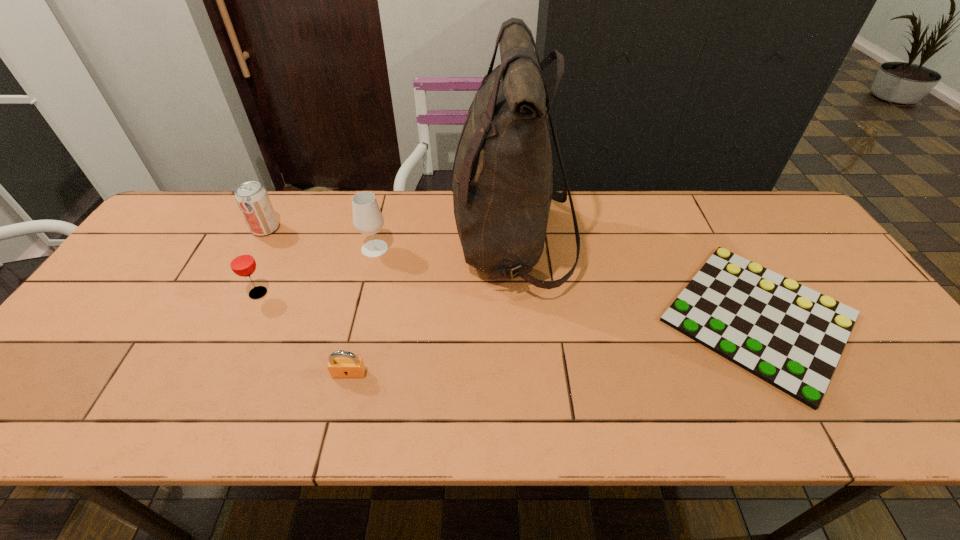
At what (x,y) coordinates should I click in order to perform the action: click on free space located 0.290m on the open flap of the fifth object from left to right. Please return your answer as a coordinate pair (x, y). Looking at the image, I should click on (356, 244).

This screenshot has width=960, height=540. In order to click on vacant space located on the open flap of the fifth object from left to right in this screenshot , I will do `click(359, 244)`.

This screenshot has height=540, width=960. I want to click on free point located 0.070m on the open flap of the fifth object from left to right, so click(x=431, y=244).

Where is `free space located 0.180m on the left of the taller glass`? The image size is (960, 540). free space located 0.180m on the left of the taller glass is located at coordinates (299, 248).

Identify the location of vacant region located 0.090m on the front of the soda can. Image resolution: width=960 pixels, height=540 pixels. (250, 259).

Identify the location of free region located 0.330m on the front of the left glass. (198, 422).

In order to click on free space located to unlock the padlock from the front in this screenshot , I will do `click(337, 426)`.

Where is `free space located on the back of the rightmost object`? The height and width of the screenshot is (540, 960). free space located on the back of the rightmost object is located at coordinates (713, 236).

Find the location of `backpack located at the far edge`. backpack located at the far edge is located at coordinates (502, 189).

Where is `glass that is at the far edge`? glass that is at the far edge is located at coordinates pos(367,217).